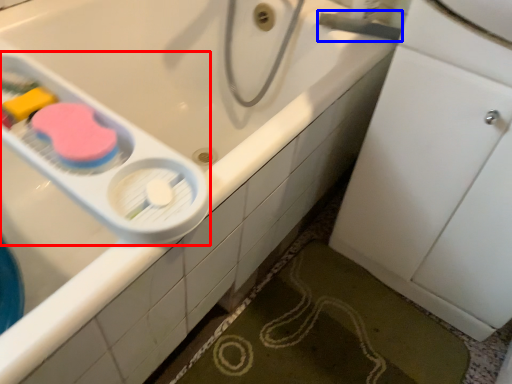
Question: Which object appears farthest to the camera in this image, scale (highlighted by a red box) or plumbing fixture (highlighted by a blue box)?

Choices:
 (A) scale
 (B) plumbing fixture

Answer: (B)